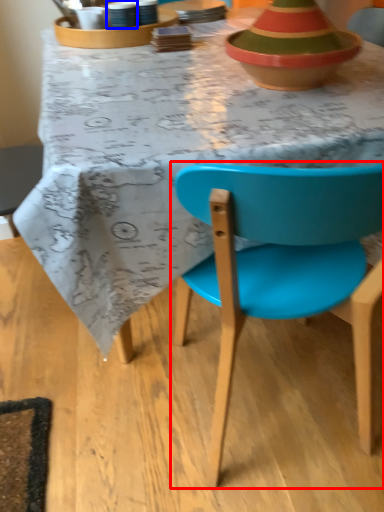
Question: Which object is closer to the camera taking this photo, chair (highlighted by a red box) or tableware (highlighted by a blue box)?

Choices:
 (A) chair
 (B) tableware

Answer: (A)